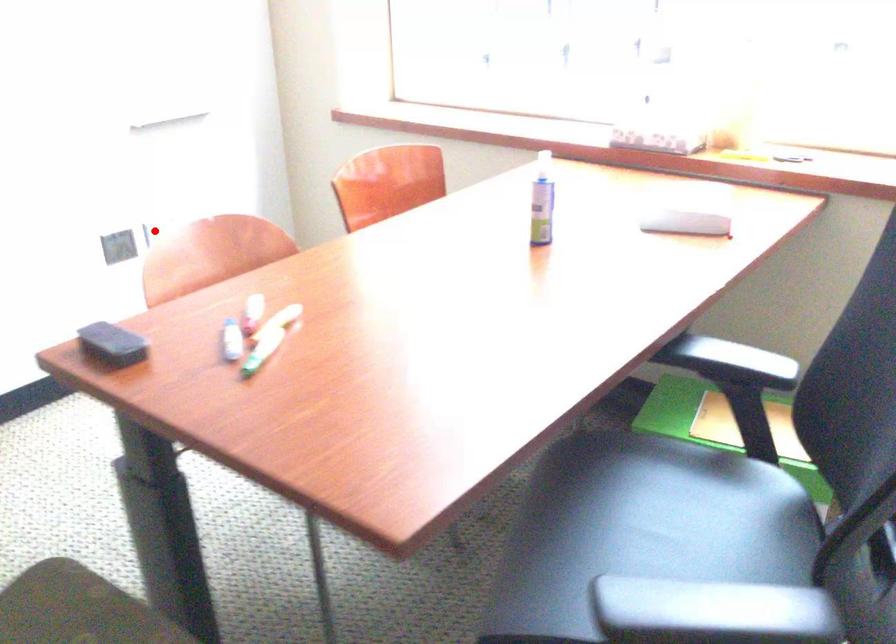
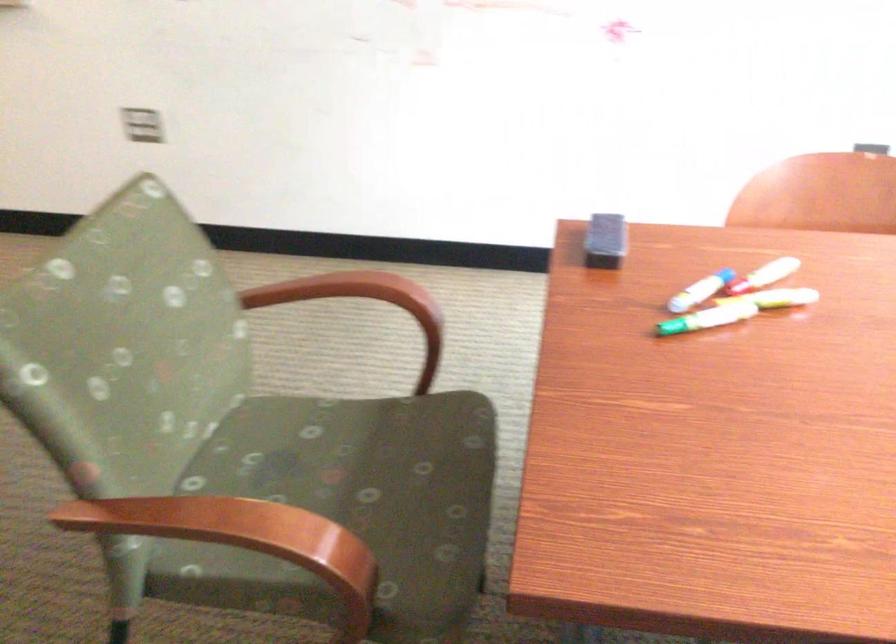
Where in the second image is the point corresponding to the highlighted location from the first image?

(871, 147)